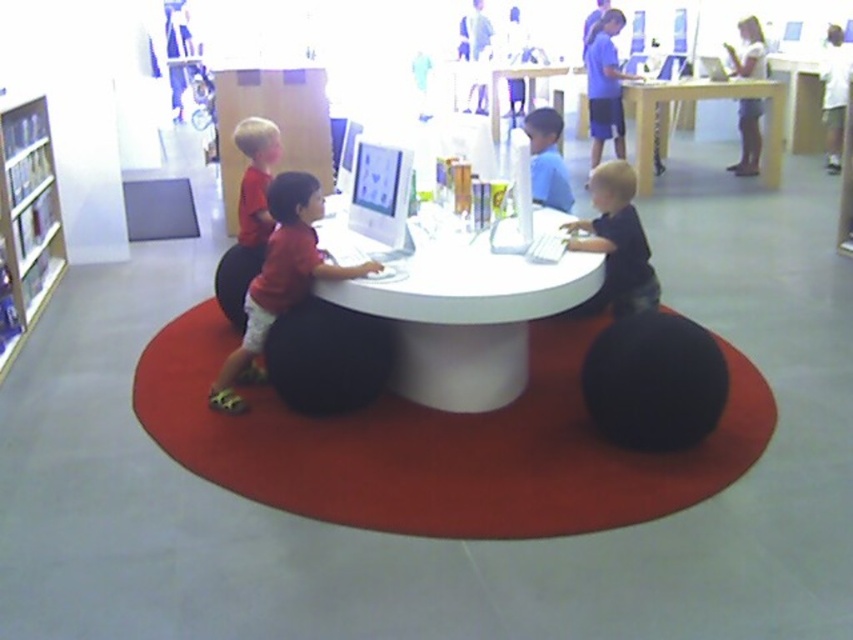
Consider the image. You are a parent trying to locate your child who is sitting at the white glossy round table at center. The table is marked with coordinates point [465,316]. Can you describe where the white glossy round table at center is located in the image?

The white glossy round table at center is located at point [465,316] in the image.

You are standing at point (548, 147) and want to walk to point (766, 84). Which direction should you move?

You should move backward because point (766, 84) is behind point (548, 147).

In the childrens area, there is a white glossy round table at center and a black matte boy at center. From the perspective of someone standing at the entrance, which object is positioned to the left?

The white glossy round table at center is to the left of the black matte boy at center from the entrance perspective.